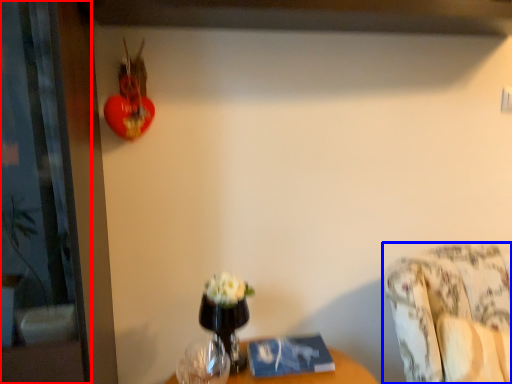
Question: Among these objects, which one is nearest to the camera, screen door (highlighted by a red box) or furniture (highlighted by a blue box)?

Choices:
 (A) screen door
 (B) furniture

Answer: (A)